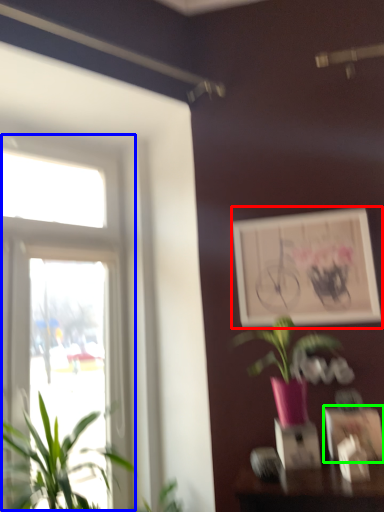
Question: Which object is the farthest from picture frame (highlighted by a red box)? Choose among these: window (highlighted by a blue box) or picture frame (highlighted by a green box).

Choices:
 (A) window
 (B) picture frame

Answer: (A)